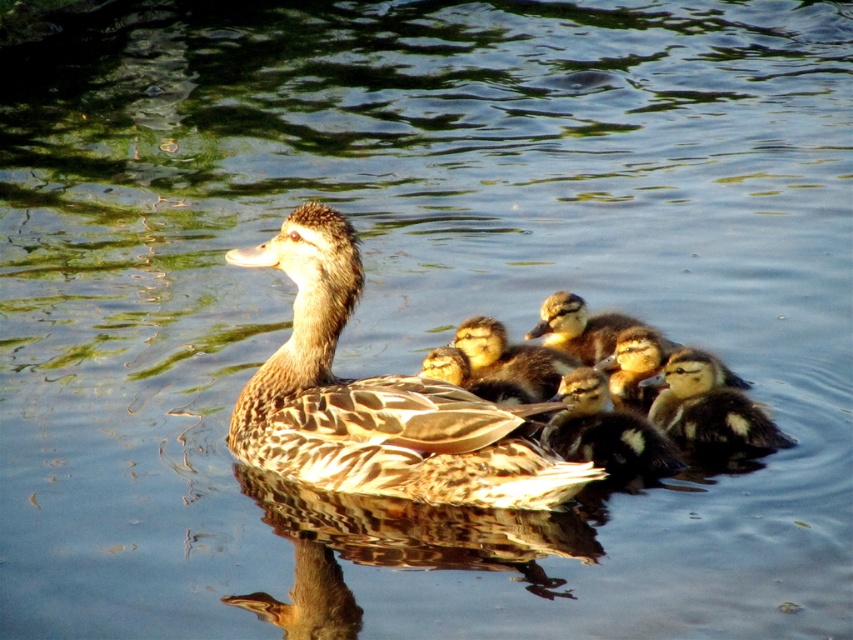
Question: Which object is farther from the camera taking this photo?

Choices:
 (A) black and white fluffy ducklings at center
 (B) black speckled ducklings at center
 (C) brown fuzzy ducklings at center

Answer: (C)

Question: Can you confirm if brown speckled ducklings at center is positioned below brown fuzzy ducklings at center?

Choices:
 (A) yes
 (B) no

Answer: (A)

Question: Which point is closer to the camera?

Choices:
 (A) brown speckled ducklings at center
 (B) brown fuzzy ducklings at center
 (C) black speckled ducklings at center
 (D) black and white fluffy ducklings at center

Answer: (C)

Question: Does black speckled ducklings at center lie behind brown fuzzy ducklings at center?

Choices:
 (A) no
 (B) yes

Answer: (A)

Question: Which point is farther to the camera?

Choices:
 (A) brown speckled ducklings at center
 (B) brown fuzzy ducklings at center
 (C) black and white fluffy ducklings at center

Answer: (B)

Question: Can you confirm if brown speckled duckling at center is wider than brown speckled ducklings at center?

Choices:
 (A) yes
 (B) no

Answer: (A)